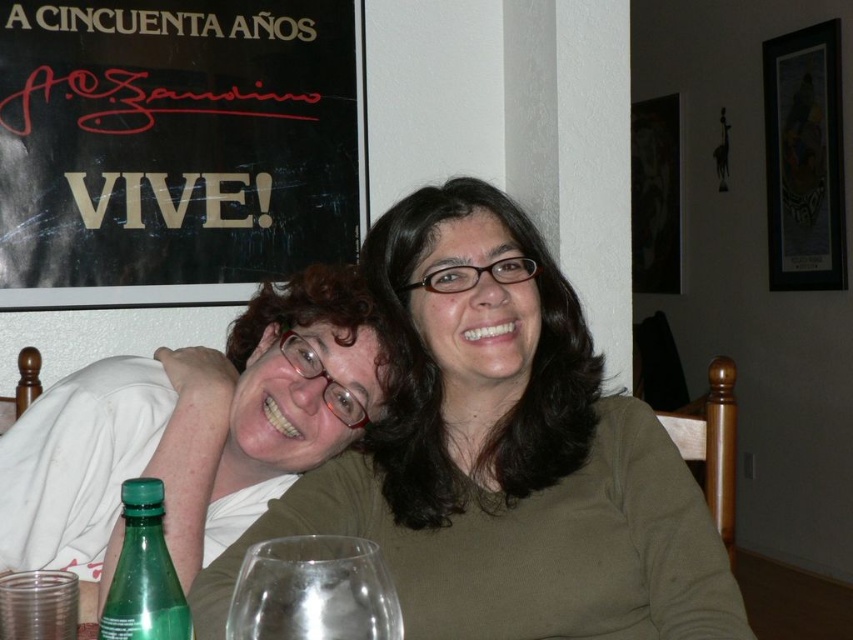
Question: Which point appears closest to the camera in this image?

Choices:
 (A) [339, 400]
 (B) [177, 625]
 (C) [213, 17]

Answer: (B)

Question: Where is transparent glass at lower center located in relation to green glass bottle at lower left in the image?

Choices:
 (A) left
 (B) right

Answer: (B)

Question: Is transparent glass at lower center above green glass bottle at lower left?

Choices:
 (A) yes
 (B) no

Answer: (A)

Question: Which of these objects is positioned farthest from the matte green shirt at center?

Choices:
 (A) transparent glass at lower center
 (B) green glass bottle at lower left

Answer: (B)

Question: Based on their relative distances, which object is nearer to the matte green shirt at center?

Choices:
 (A) transparent glass at lower center
 (B) matte white shirt at left
 (C) black paper at upper left
 (D) green glass bottle at lower left

Answer: (B)

Question: Considering the relative positions of matte green shirt at center and green glass bottle at lower left in the image provided, where is matte green shirt at center located with respect to green glass bottle at lower left?

Choices:
 (A) left
 (B) right

Answer: (B)